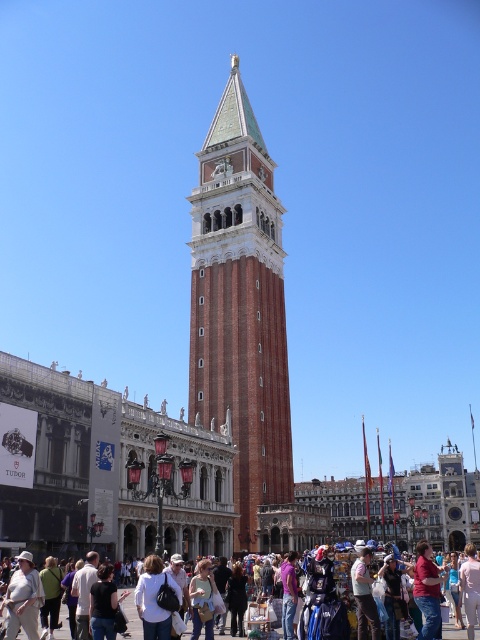
Question: Which of the following is the farthest from the observer?

Choices:
 (A) matte white crowd at lower center
 (B) red brick bell tower at center

Answer: (B)

Question: Which point is farther to the camera?

Choices:
 (A) (417, 544)
 (B) (127, 611)

Answer: (A)

Question: Does matte pink shirt at center have a greater width compared to matte white crowd at lower center?

Choices:
 (A) no
 (B) yes

Answer: (A)

Question: Considering the real-world distances, which object is closest to the matte white crowd at lower center?

Choices:
 (A) red brick bell tower at center
 (B) matte pink shirt at center

Answer: (B)

Question: Is red brick bell tower at center closer to camera compared to matte white crowd at lower center?

Choices:
 (A) no
 (B) yes

Answer: (A)

Question: Does matte pink shirt at center have a greater width compared to matte white crowd at lower center?

Choices:
 (A) yes
 (B) no

Answer: (B)